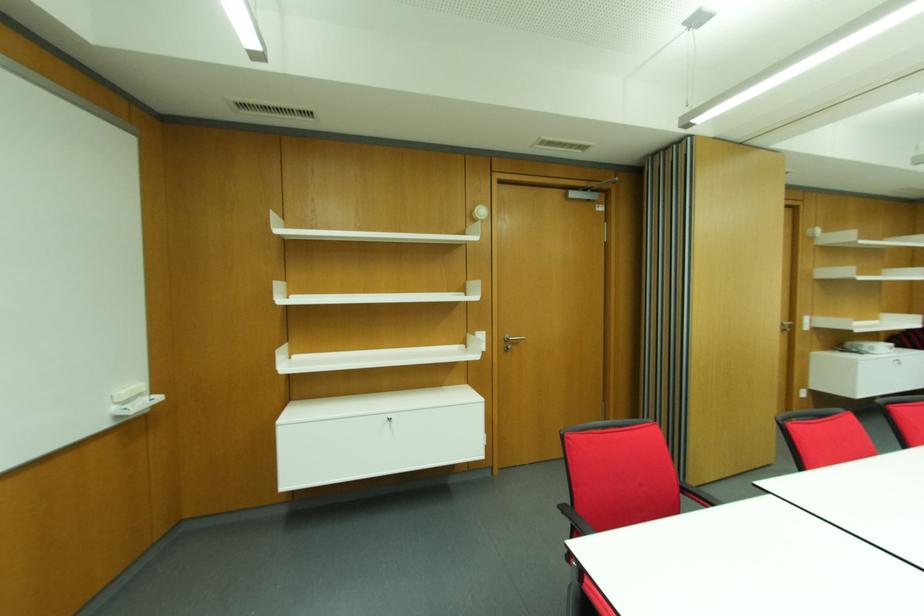
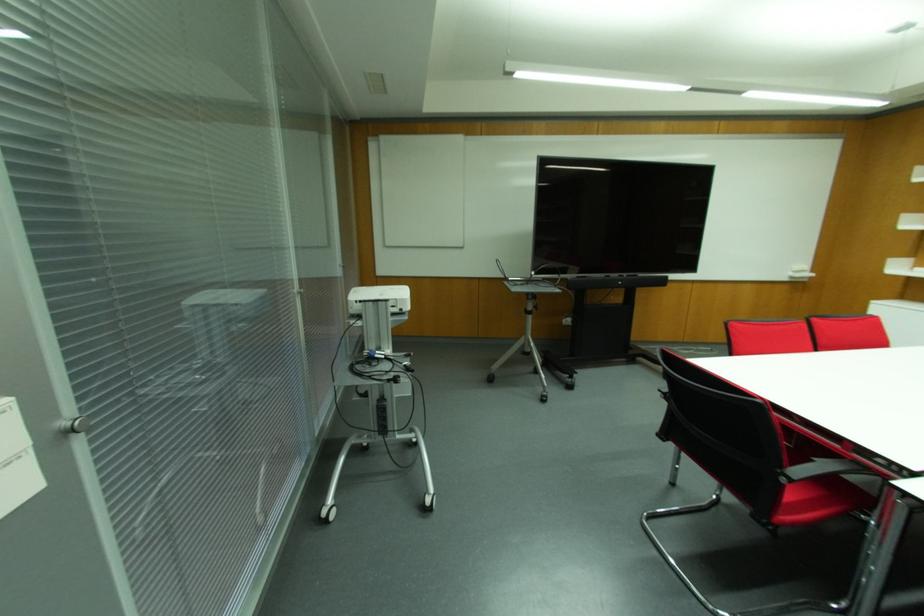
Locate, in the second image, the point that corresponds to (160,397) in the first image.

(811, 274)